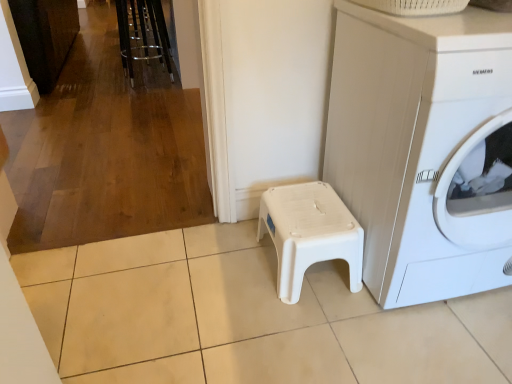
The image size is (512, 384). In order to click on free space in front of white plastic stool at center in this screenshot , I will do `click(314, 334)`.